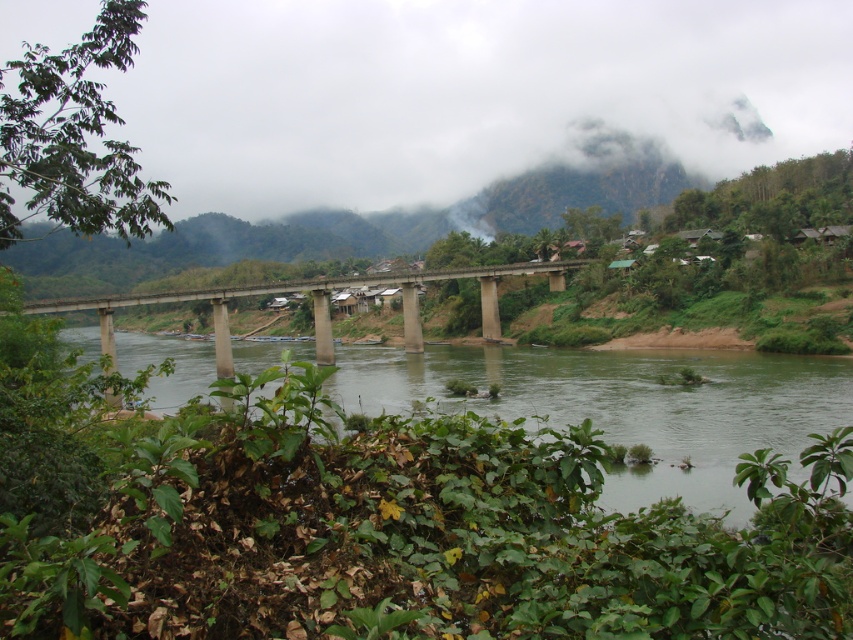
Question: Estimate the real-world distances between objects in this image. Which object is farther from the white foggy cloud at upper center?

Choices:
 (A) concrete bridge at center
 (B) green water at center

Answer: (A)

Question: Is green water at center positioned at the back of concrete bridge at center?

Choices:
 (A) no
 (B) yes

Answer: (A)

Question: Is green water at center thinner than concrete bridge at center?

Choices:
 (A) yes
 (B) no

Answer: (B)

Question: Which object appears closest to the camera in this image?

Choices:
 (A) green water at center
 (B) white foggy cloud at upper center

Answer: (A)

Question: Among these objects, which one is nearest to the camera?

Choices:
 (A) concrete bridge at center
 (B) white foggy cloud at upper center

Answer: (A)

Question: Is white foggy cloud at upper center closer to the viewer compared to concrete bridge at center?

Choices:
 (A) yes
 (B) no

Answer: (B)